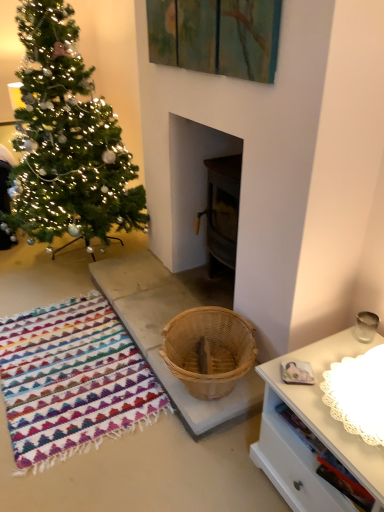
At what (x,y) coordinates should I click in order to perform the action: click on empty space that is ontop of natural wood basket at center. Please return your answer as a coordinate pair (x, y). The image size is (384, 512). Looking at the image, I should click on (151, 303).